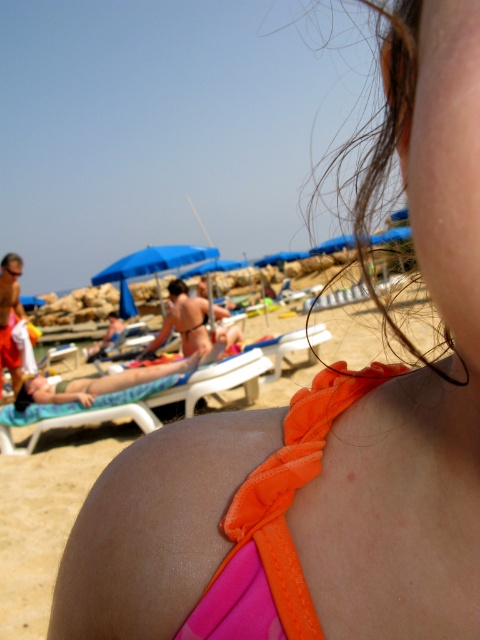
Which is in front, point (225, 600) or point (199, 387)?

Point (225, 600) is more forward.

Between point (238, 557) and point (168, 401), which one is positioned behind?

Point (168, 401)

I want to click on orange fabric bikini top at upper center, so click(x=276, y=522).